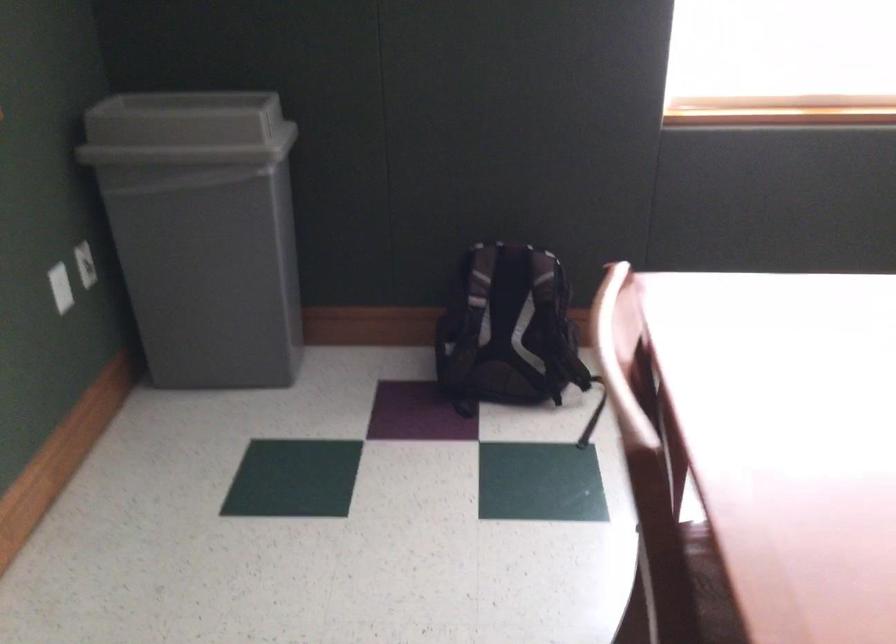
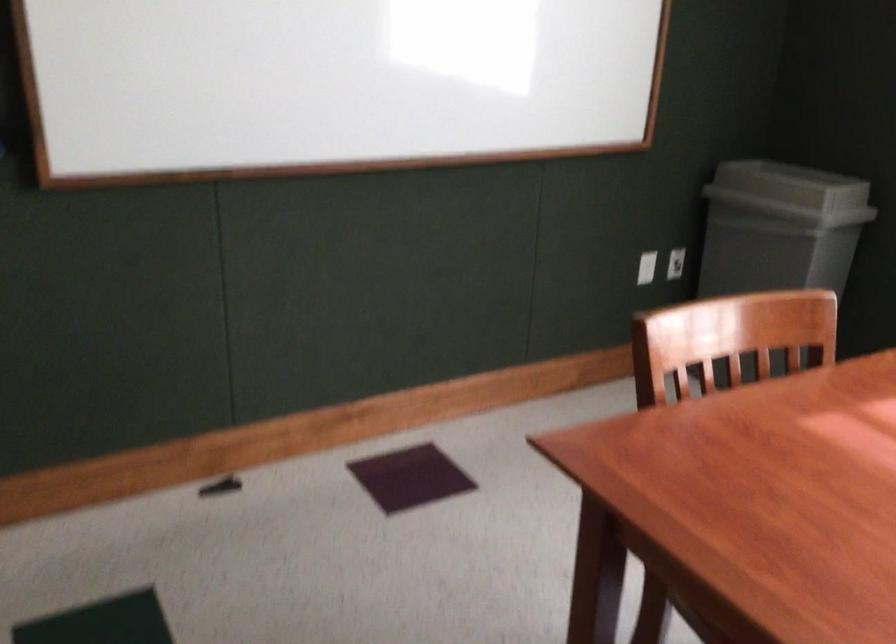
In the second image, find the point that corresponds to the point at 228,126 in the first image.

(791, 185)